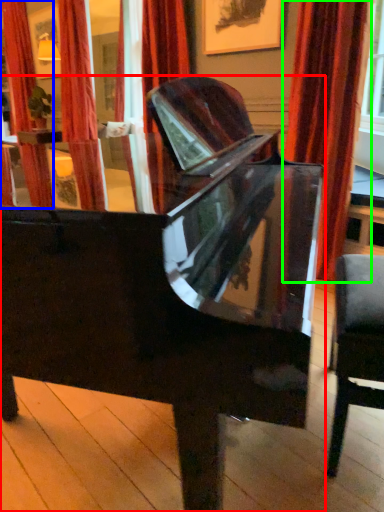
Question: Considering the real-world distances, which object is farthest from piano (highlighted by a red box)? curtain (highlighted by a blue box) or curtain (highlighted by a green box)?

Choices:
 (A) curtain
 (B) curtain

Answer: (A)